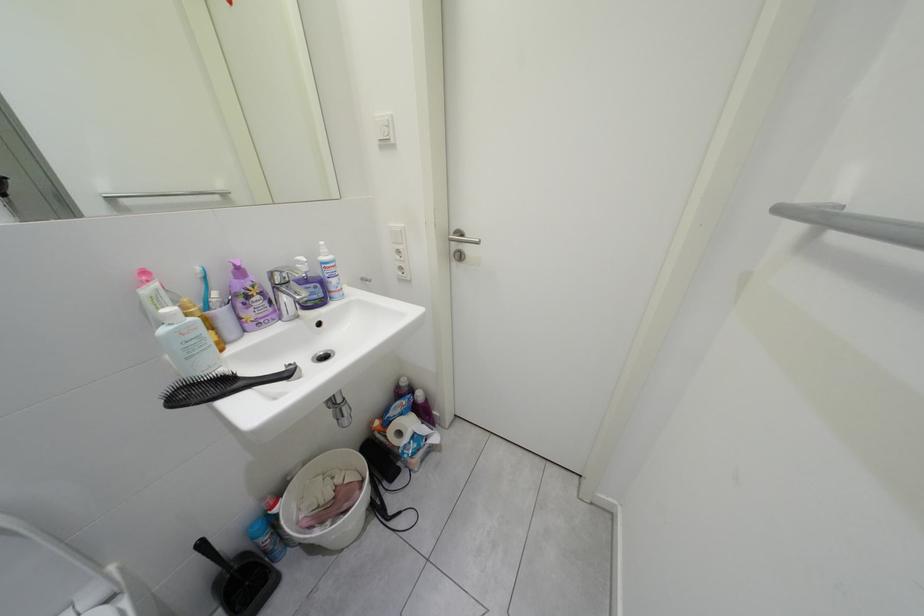
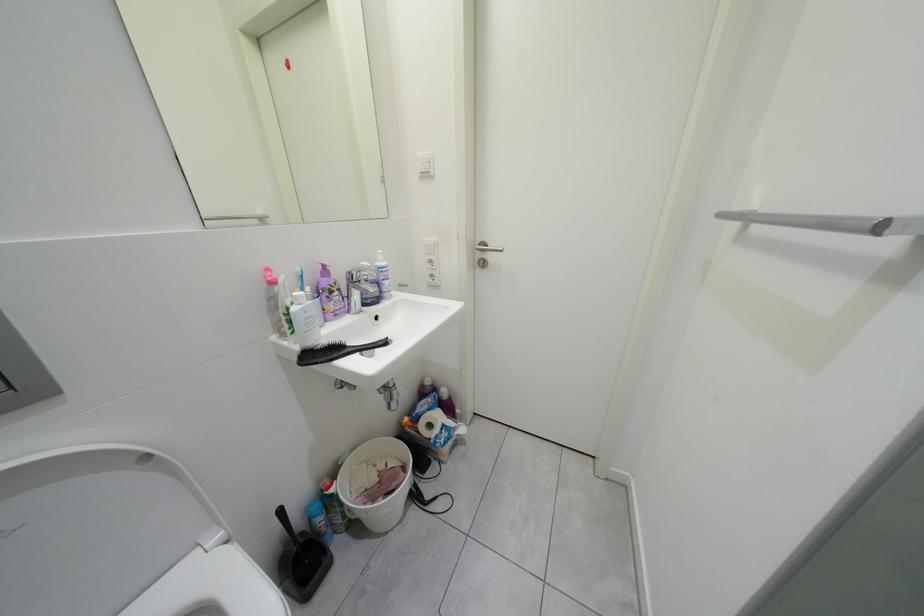
The images are taken continuously from a first-person perspective. In which direction are you moving?

The movement direction of the cameraman is left, backward.